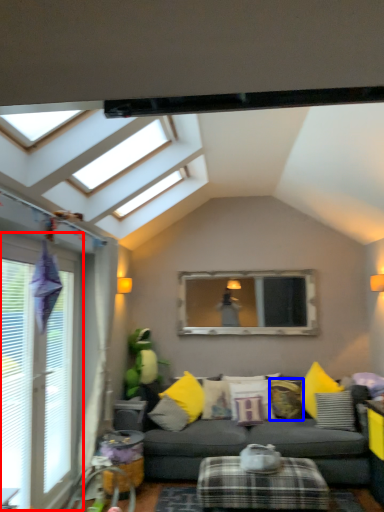
Question: Which object appears closest to the camera in this image, window (highlighted by a red box) or pillow (highlighted by a blue box)?

Choices:
 (A) window
 (B) pillow

Answer: (A)